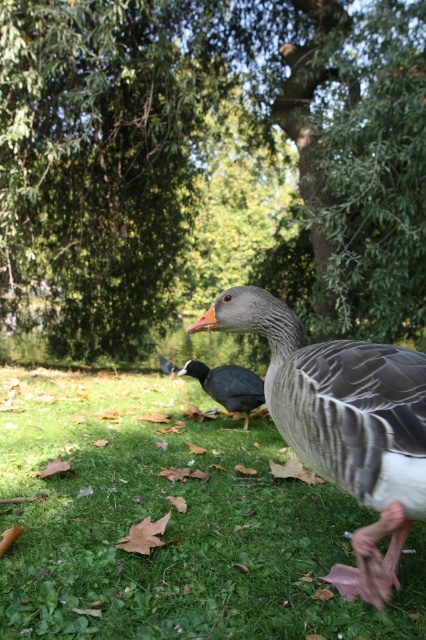
You are a photographer trying to capture a wide shot of the green leafy tree at center and the green grassy at lower center. Which object should you focus on first if you want to ensure both are in sharp focus?

You should focus on the green leafy tree at center first because it is larger in size compared to the green grassy at lower center, so it will require more precise focusing to capture its details clearly.

You are a bird flying at an altitude of 5 meters. You want to land on the green grassy at lower center. Can you safely descend from the green leafy tree at center to land there?

The green leafy tree at center is 5.85 meters away from the green grassy at lower center. Since you are flying at 5 meters altitude, you can safely descend to land on the green grassy at lower center as the distance between them allows for a gradual descent.

You are standing at the origin point in the image. There are two points marked as point 1 at coordinates point (236, 385) and point 2 at coordinates point (170, 364). Which point is closer to you?

Point (236, 385) is in front of point (170, 364), so point 1 is closer to you.